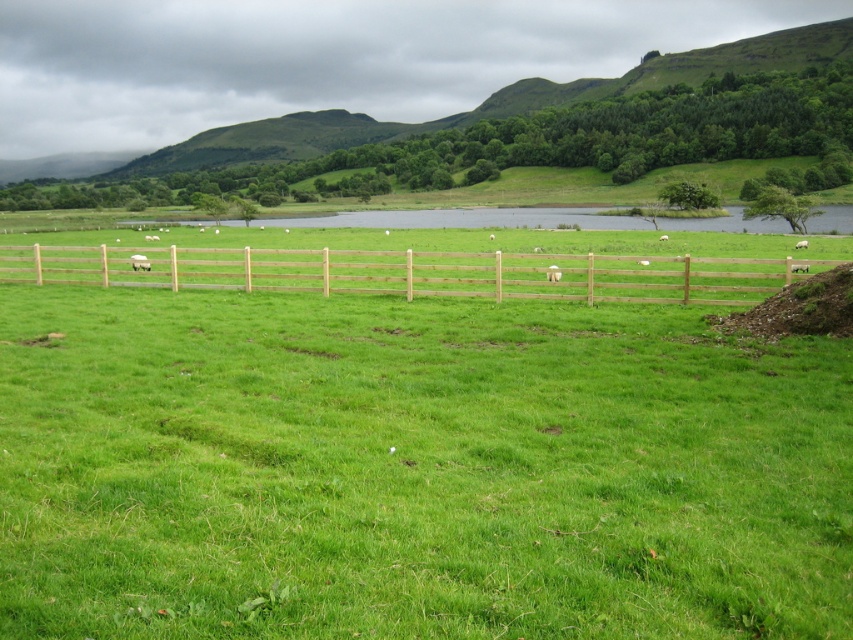
Question: Is white woolly sheep at center thinner than white fluffy wool at center?

Choices:
 (A) no
 (B) yes

Answer: (B)

Question: Can you confirm if white woolly sheep at center is positioned below white fluffy wool at center?

Choices:
 (A) yes
 (B) no

Answer: (B)

Question: Estimate the real-world distances between objects in this image. Which object is farther from the brown wooden fence at center?

Choices:
 (A) white woolly sheep at center
 (B) white fluffy wool at center

Answer: (A)

Question: Estimate the real-world distances between objects in this image. Which object is closer to the brown wooden fence at center?

Choices:
 (A) white woolly sheep at center
 (B) white fluffy wool at center

Answer: (B)

Question: In this image, where is white woolly sheep at center located relative to white fluffy wool at center?

Choices:
 (A) above
 (B) below

Answer: (A)

Question: Based on their relative distances, which object is nearer to the brown wooden fence at center?

Choices:
 (A) white woolly sheep at center
 (B) white fluffy wool at center

Answer: (B)